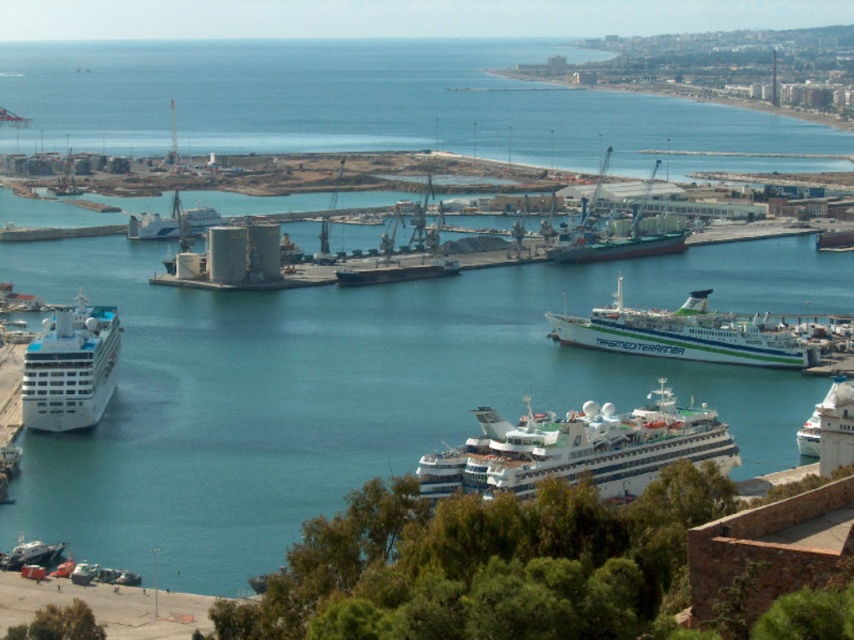
You are a photographer planning to capture the entire harbor scene. You notice the clear blue water at center and the white glossy cruise ship at lower left. Which of these two elements takes up more horizontal space in the image?

The clear blue water at center takes up more horizontal space because its width is larger than that of the white glossy cruise ship at lower left.